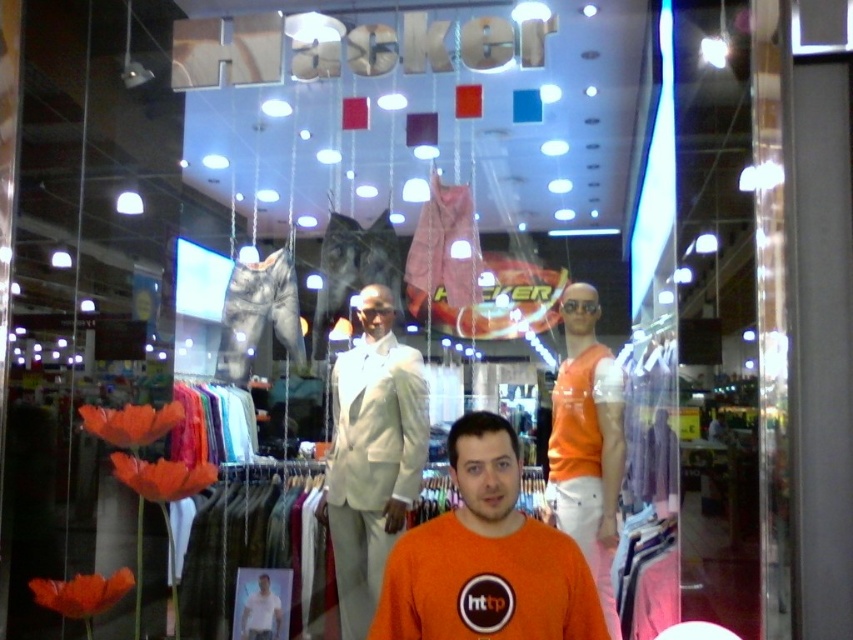
What do you see at coordinates (486, 557) in the screenshot?
I see `orange cotton t-shirt at center` at bounding box center [486, 557].

Is point (527, 557) closer to camera compared to point (560, 301)?

Yes, it is in front of point (560, 301).

Which is behind, point (401, 634) or point (577, 467)?

Point (577, 467)

At what (x,y) coordinates should I click in order to perform the action: click on orange cotton t-shirt at center. Please return your answer as a coordinate pair (x, y). This screenshot has width=853, height=640. Looking at the image, I should click on (486, 557).

Is white satin suit at center wider than orange fabric mannequin at right?

Yes.

Is white satin suit at center above orange fabric mannequin at right?

Actually, white satin suit at center is below orange fabric mannequin at right.

Is point (386, 513) less distant than point (572, 451)?

No, (386, 513) is behind (572, 451).

Identify the location of white satin suit at center. (370, 456).

Does orange cotton t-shirt at center appear under white satin suit at center?

No, orange cotton t-shirt at center is not below white satin suit at center.

Does orange cotton t-shirt at center appear on the right side of white satin suit at center?

Yes, orange cotton t-shirt at center is to the right of white satin suit at center.

Image resolution: width=853 pixels, height=640 pixels. What are the coordinates of `orange cotton t-shirt at center` in the screenshot? It's located at (486, 557).

Where is `orange cotton t-shirt at center`? orange cotton t-shirt at center is located at coordinates (486, 557).